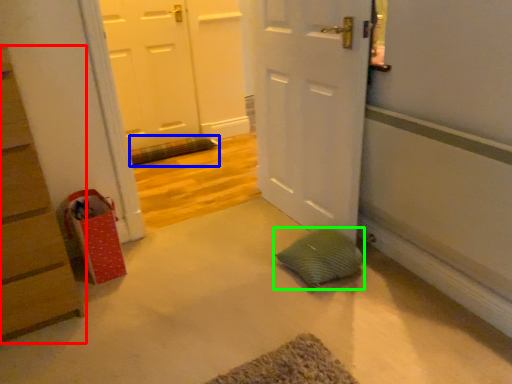
Question: Which object is positioned closest to chest of drawers (highlighted by a red box)? Select from bath mat (highlighted by a blue box) and pillow (highlighted by a green box).

Choices:
 (A) bath mat
 (B) pillow

Answer: (B)